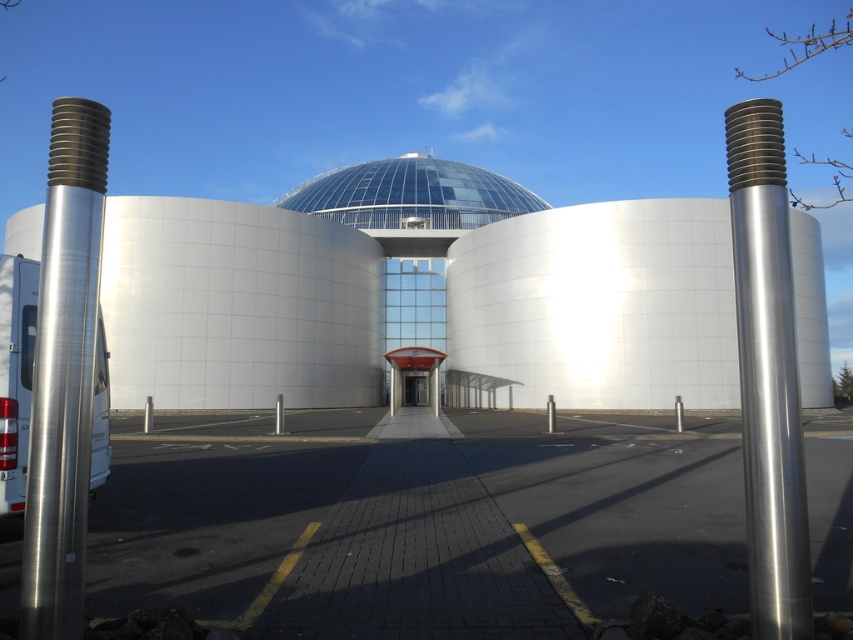
Who is shorter, polished metallic pole at right or transparent glass dome at center?

With less height is polished metallic pole at right.

Is polished metallic pole at right bigger than transparent glass dome at center?

No, polished metallic pole at right is not bigger than transparent glass dome at center.

What do you see at coordinates (769, 372) in the screenshot?
I see `polished metallic pole at right` at bounding box center [769, 372].

Image resolution: width=853 pixels, height=640 pixels. I want to click on polished metallic pole at right, so click(x=769, y=372).

Can you confirm if polished silver pole at left is bigger than transparent glass dome at center?

No, polished silver pole at left is not bigger than transparent glass dome at center.

Does polished silver pole at left appear on the right side of transparent glass dome at center?

Correct, you'll find polished silver pole at left to the right of transparent glass dome at center.

What do you see at coordinates (64, 372) in the screenshot?
I see `polished silver pole at left` at bounding box center [64, 372].

Where is `polished silver pole at left`? The image size is (853, 640). polished silver pole at left is located at coordinates (64, 372).

Can you confirm if polished silver pole at left is positioned above polished metallic pole at right?

Indeed, polished silver pole at left is positioned over polished metallic pole at right.

From the picture: Is polished silver pole at left below polished metallic pole at right?

Incorrect, polished silver pole at left is not positioned below polished metallic pole at right.

I want to click on polished silver pole at left, so click(64, 372).

Find the location of a particular element. The image size is (853, 640). polished silver pole at left is located at coordinates (64, 372).